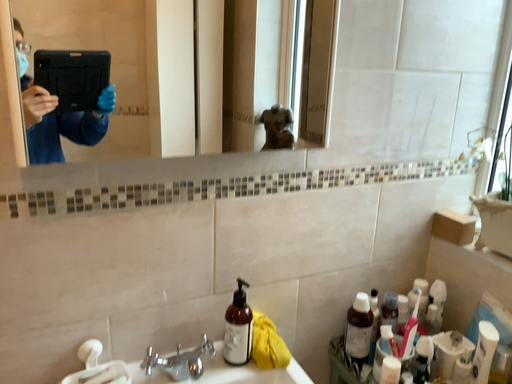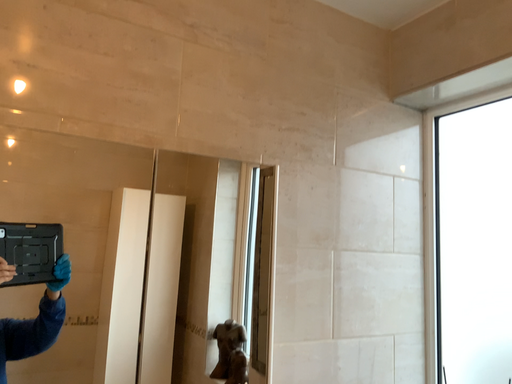
Question: How did the camera likely rotate when shooting the video?

Choices:
 (A) rotated downward
 (B) rotated upward

Answer: (B)